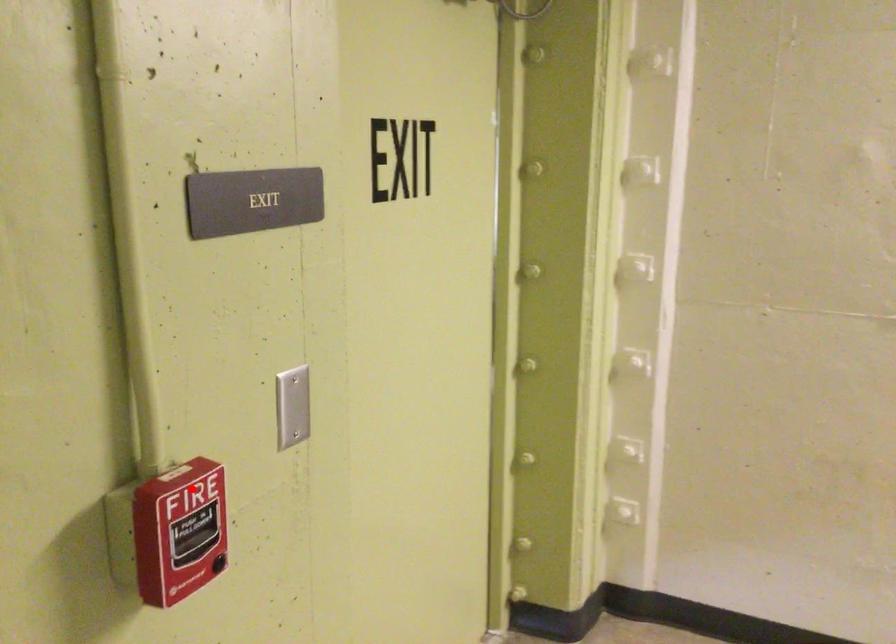
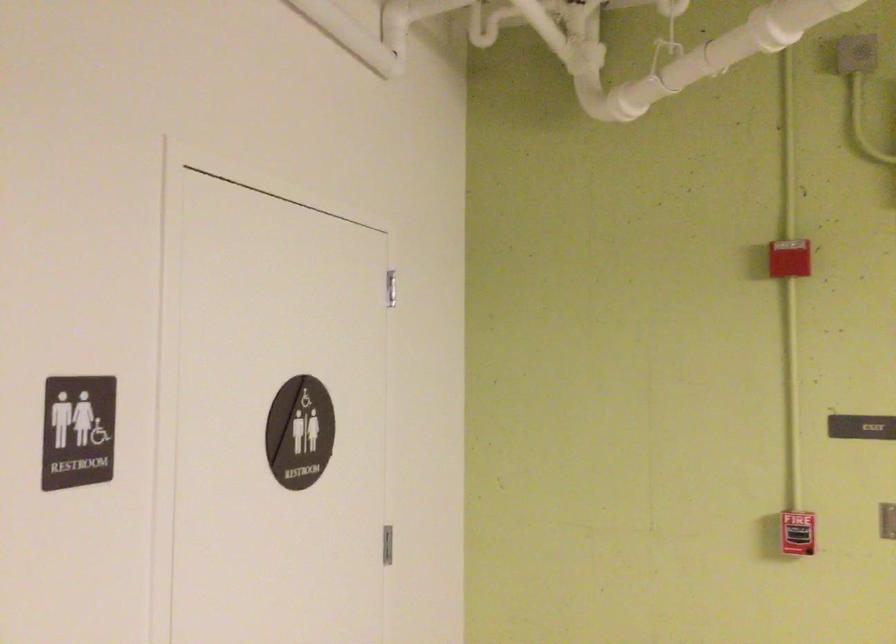
Question: I am providing you with two images of the same scene from different viewpoints. In image1, a red point is highlighted. Considering the same 3D point in image2, which of the following is correct?

Choices:
 (A) It is closer
 (B) It is farther

Answer: (B)